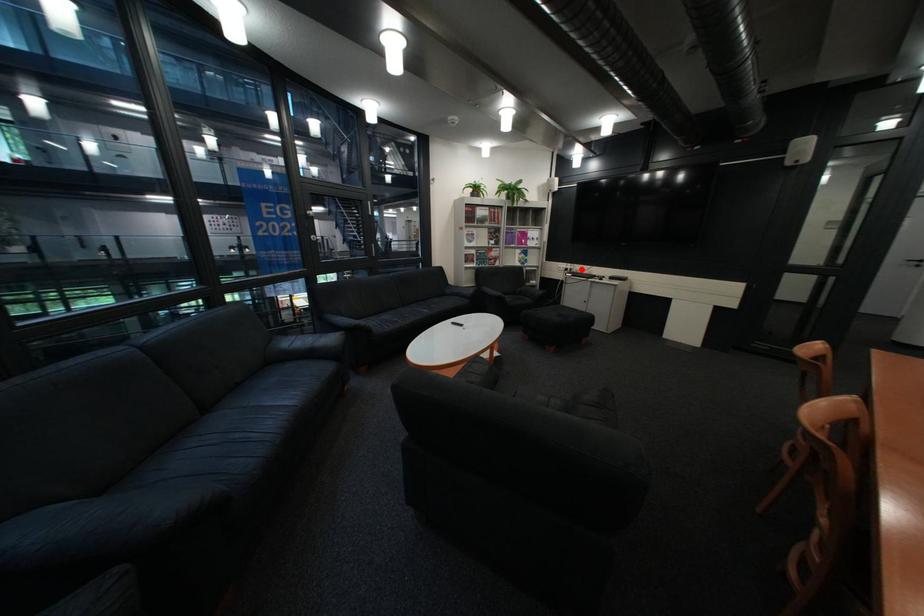
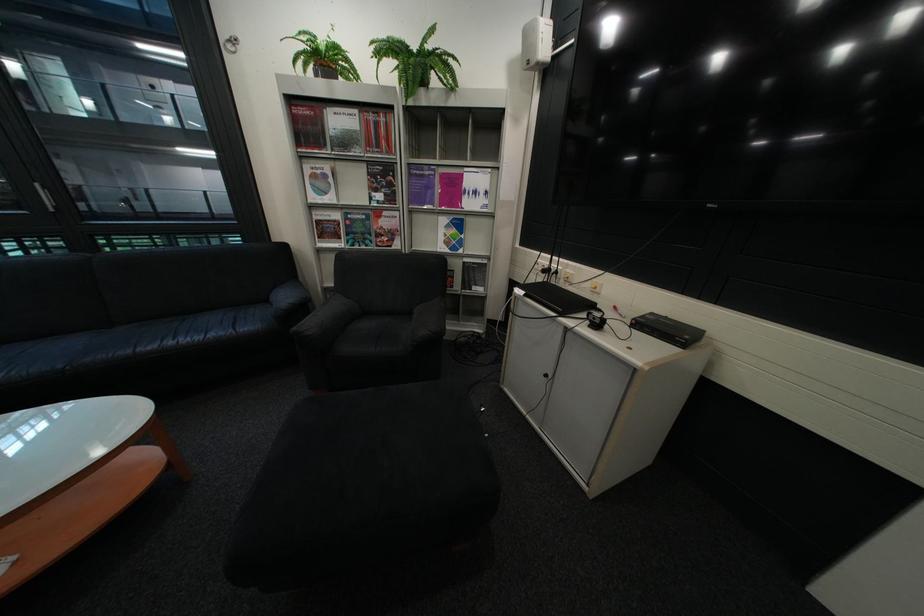
Locate, in the second image, the point that corresponds to the highlighted location in the first image.

(563, 270)